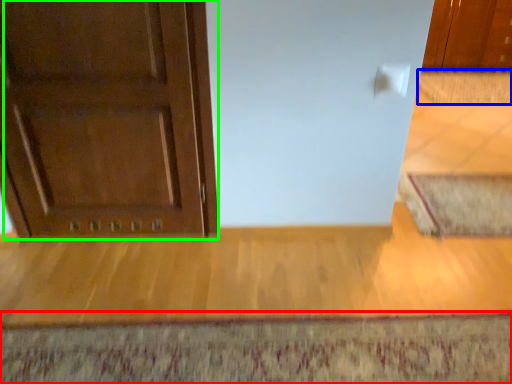
Question: Considering the real-world distances, which object is closest to doormat (highlighted by a red box)? doormat (highlighted by a blue box) or door (highlighted by a green box).

Choices:
 (A) doormat
 (B) door

Answer: (B)